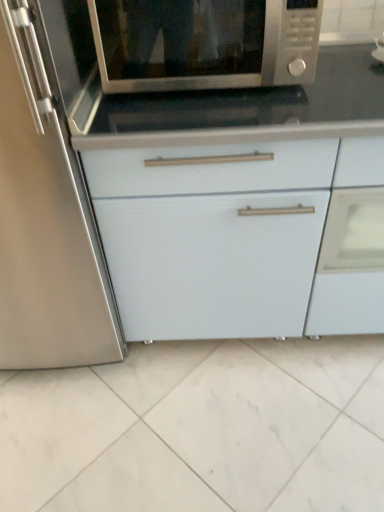
Question: Considering the relative sizes of white matte cabinet at center and satin silver microwave at upper center in the image provided, is white matte cabinet at center thinner than satin silver microwave at upper center?

Choices:
 (A) yes
 (B) no

Answer: (B)

Question: Does white matte cabinet at center have a smaller size compared to satin silver microwave at upper center?

Choices:
 (A) no
 (B) yes

Answer: (A)

Question: From the image's perspective, is white matte cabinet at center on top of satin silver microwave at upper center?

Choices:
 (A) no
 (B) yes

Answer: (A)

Question: Is white matte cabinet at center outside of satin silver microwave at upper center?

Choices:
 (A) yes
 (B) no

Answer: (A)

Question: Does white matte cabinet at center appear on the right side of satin silver microwave at upper center?

Choices:
 (A) yes
 (B) no

Answer: (A)

Question: From a real-world perspective, is white matte cabinet at center located beneath satin silver microwave at upper center?

Choices:
 (A) no
 (B) yes

Answer: (B)

Question: Considering the relative sizes of satin silver microwave at upper center and white matte cabinet at center in the image provided, is satin silver microwave at upper center wider than white matte cabinet at center?

Choices:
 (A) yes
 (B) no

Answer: (B)

Question: Does satin silver microwave at upper center have a lesser height compared to white matte cabinet at center?

Choices:
 (A) yes
 (B) no

Answer: (A)

Question: Does satin silver microwave at upper center appear on the right side of white matte cabinet at center?

Choices:
 (A) no
 (B) yes

Answer: (A)

Question: Would you say white matte cabinet at center is part of satin silver microwave at upper center's contents?

Choices:
 (A) no
 (B) yes

Answer: (A)

Question: Are satin silver microwave at upper center and white matte cabinet at center making contact?

Choices:
 (A) yes
 (B) no

Answer: (B)

Question: From the image's perspective, does satin silver microwave at upper center appear higher than white matte cabinet at center?

Choices:
 (A) yes
 (B) no

Answer: (A)

Question: Considering the positions of white matte cabinet at center and satin silver microwave at upper center in the image, is white matte cabinet at center taller or shorter than satin silver microwave at upper center?

Choices:
 (A) short
 (B) tall

Answer: (B)